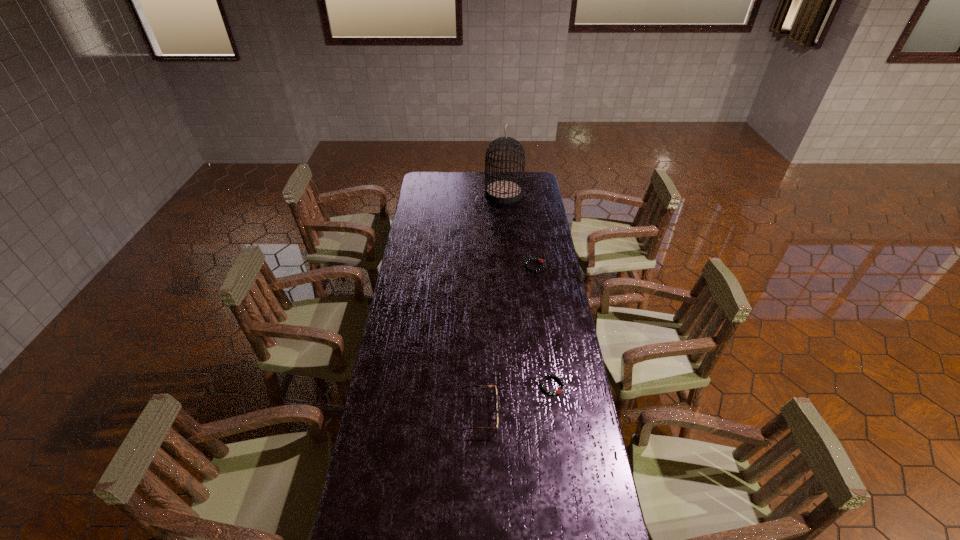
This screenshot has height=540, width=960. In order to click on the farthest object in this screenshot , I will do `click(504, 191)`.

You are a GUI agent. You are given a task and a screenshot of the screen. Output one action in this format:
    pyautogui.click(x=<x>, y=<y>)
    Task: Click on the birdcage
    This screenshot has width=960, height=540.
    Given the screenshot: What is the action you would take?
    [x=504, y=191]

The height and width of the screenshot is (540, 960). Find the location of `the second tallest object`. the second tallest object is located at coordinates (479, 386).

I want to click on the farther bracelet, so click(x=537, y=259).

The height and width of the screenshot is (540, 960). I want to click on the nearer bracelet, so click(558, 391).

Where is `free space located 0.070m on the front of the farthest object`? This screenshot has width=960, height=540. free space located 0.070m on the front of the farthest object is located at coordinates (505, 211).

You are a GUI agent. You are given a task and a screenshot of the screen. Output one action in this format:
    pyautogui.click(x=<x>, y=<y>)
    Task: Click on the vacant space located 0.160m on the frame of the third shortest object
    The image size is (960, 540).
    Given the screenshot: What is the action you would take?
    pyautogui.click(x=545, y=414)

This screenshot has height=540, width=960. I want to click on vacant space located on the back of the second farthest object, so click(x=528, y=216).

In order to click on free location located on the back of the nearer bracelet in this screenshot , I will do `click(546, 345)`.

Locate an element on the screen. The width and height of the screenshot is (960, 540). object located at the far edge is located at coordinates (504, 191).